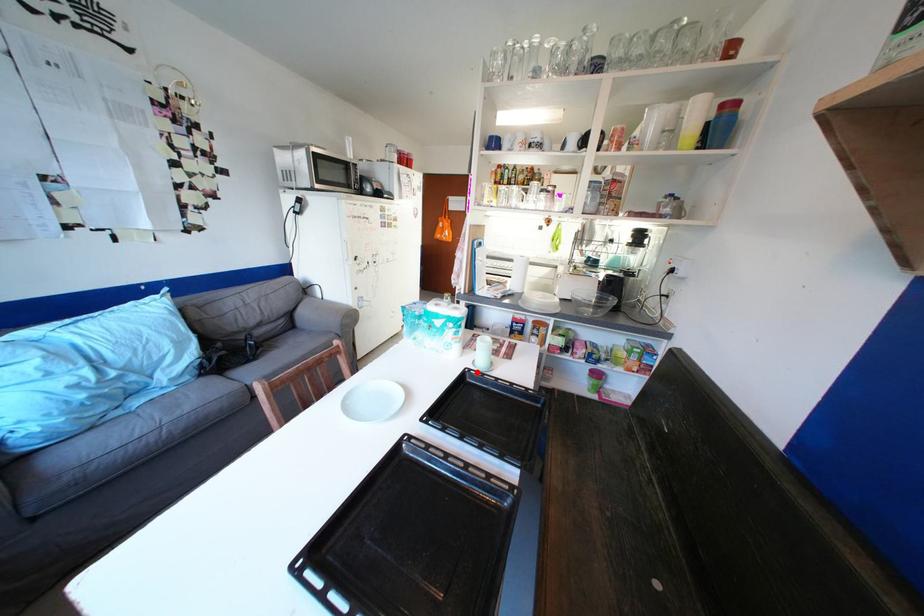
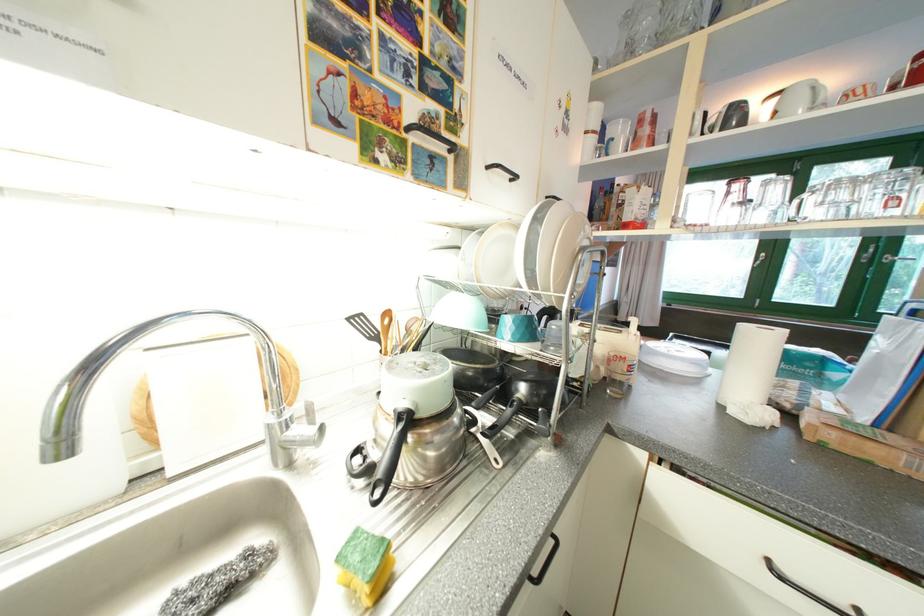
Question: I am providing you with two images of the same scene from different viewpoints. A red point is marked on the first image. At the location where the point appears in image 1, is it still visible in image 2?

Choices:
 (A) Yes
 (B) No

Answer: (B)